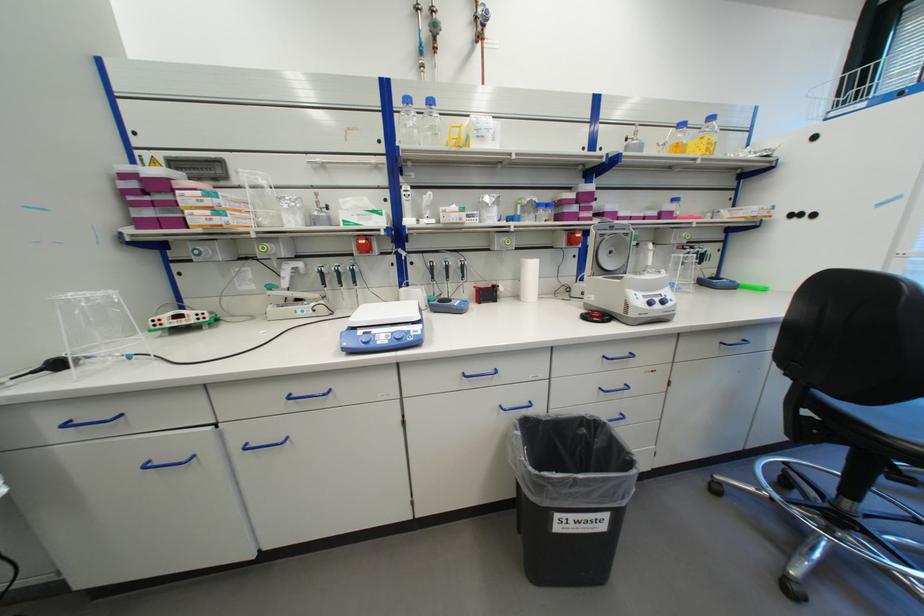
Find the location of a particular element. This screenshot has height=616, width=924. chair sitting surface is located at coordinates (892, 418).